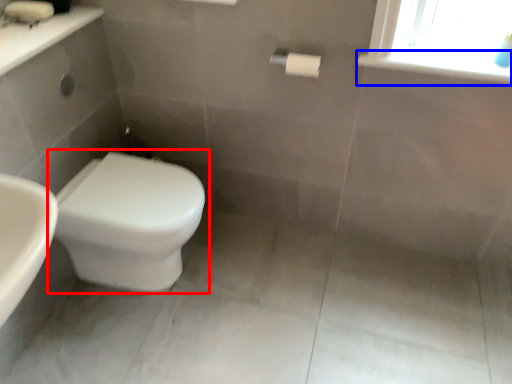
Question: Which object is further to the camera taking this photo, toilet (highlighted by a red box) or window sill (highlighted by a blue box)?

Choices:
 (A) toilet
 (B) window sill

Answer: (A)